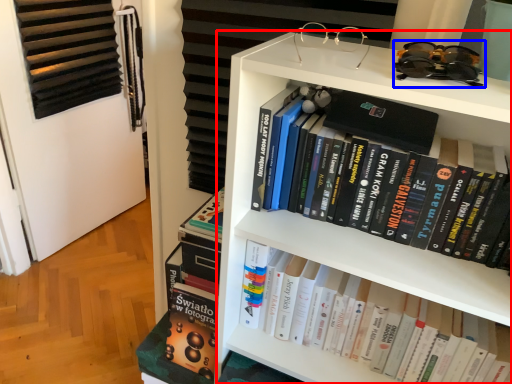
Question: Among these objects, which one is nearest to the camera, bookcase (highlighted by a red box) or glasses (highlighted by a blue box)?

Choices:
 (A) bookcase
 (B) glasses

Answer: (B)